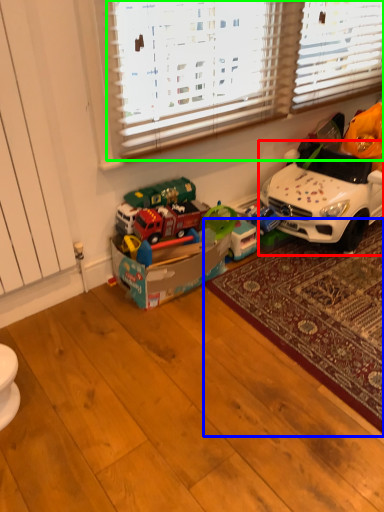
Question: Estimate the real-world distances between objects in this image. Which object is closer to car (highlighted by a red box), mat (highlighted by a blue box) or blind (highlighted by a green box)?

Choices:
 (A) mat
 (B) blind

Answer: (A)